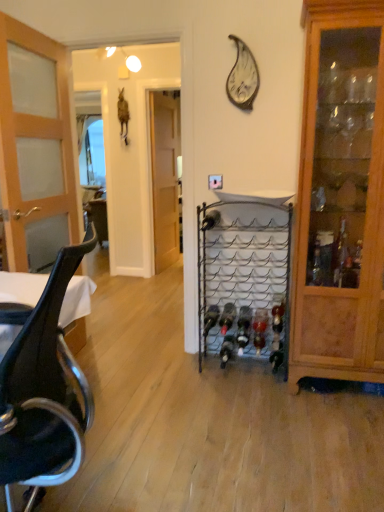
Question: Does wooden door at center, placed as the first door when sorted from right to left, have a greater height compared to metallic silver wine bottle at center, the third wine bottle positioned from the left?

Choices:
 (A) yes
 (B) no

Answer: (A)

Question: Is wooden door at center, arranged as the second door when viewed from the left, positioned before metallic silver wine bottle at center, placed as the fifth wine bottle when sorted from right to left?

Choices:
 (A) no
 (B) yes

Answer: (A)

Question: Is the depth of wooden door at center, which ranks as the 1th door in back-to-front order, greater than that of metallic silver wine bottle at center, placed as the fifth wine bottle when sorted from right to left?

Choices:
 (A) yes
 (B) no

Answer: (A)

Question: Is metallic silver wine bottle at center, placed as the fifth wine bottle when sorted from right to left, completely or partially inside wooden door at center, which ranks as the 1th door in back-to-front order?

Choices:
 (A) no
 (B) yes

Answer: (A)

Question: Is wooden door at center, which ranks as the 1th door in back-to-front order, thinner than metallic silver wine bottle at center, the third wine bottle positioned from the left?

Choices:
 (A) no
 (B) yes

Answer: (B)

Question: Is wooden door at center, which ranks as the 1th door in back-to-front order, facing away from metallic silver wine bottle at center, the third wine bottle positioned from the left?

Choices:
 (A) no
 (B) yes

Answer: (A)

Question: Is black glass wine bottle at center, which is the sixth wine bottle in right-to-left order, at the left side of translucent glass wine bottle at center, arranged as the first wine bottle when viewed from the right?

Choices:
 (A) no
 (B) yes

Answer: (B)

Question: Considering the relative sizes of black glass wine bottle at center, which is the sixth wine bottle in right-to-left order, and translucent glass wine bottle at center, acting as the seventh wine bottle starting from the left, in the image provided, is black glass wine bottle at center, which is the sixth wine bottle in right-to-left order, taller than translucent glass wine bottle at center, acting as the seventh wine bottle starting from the left,?

Choices:
 (A) no
 (B) yes

Answer: (B)

Question: Would you consider black glass wine bottle at center, which is the sixth wine bottle in right-to-left order, to be distant from translucent glass wine bottle at center, arranged as the first wine bottle when viewed from the right?

Choices:
 (A) yes
 (B) no

Answer: (B)

Question: From a real-world perspective, is black glass wine bottle at center, which is the sixth wine bottle in right-to-left order, under translucent glass wine bottle at center, arranged as the first wine bottle when viewed from the right?

Choices:
 (A) no
 (B) yes

Answer: (B)

Question: From the image's perspective, is black glass wine bottle at center, which appears as the 2th wine bottle when viewed from the left, located above translucent glass wine bottle at center, arranged as the first wine bottle when viewed from the right?

Choices:
 (A) yes
 (B) no

Answer: (B)

Question: Is translucent glass wine bottle at center, acting as the seventh wine bottle starting from the left, located within black glass wine bottle at center, which is the sixth wine bottle in right-to-left order?

Choices:
 (A) no
 (B) yes

Answer: (A)

Question: Considering the relative positions of black glass wine bottle at center, which appears as the 2th wine bottle when viewed from the left, and light brown wooden door at left, the 1th door positioned from the front, in the image provided, is black glass wine bottle at center, which appears as the 2th wine bottle when viewed from the left, to the left of light brown wooden door at left, the 1th door positioned from the front, from the viewer's perspective?

Choices:
 (A) yes
 (B) no

Answer: (B)